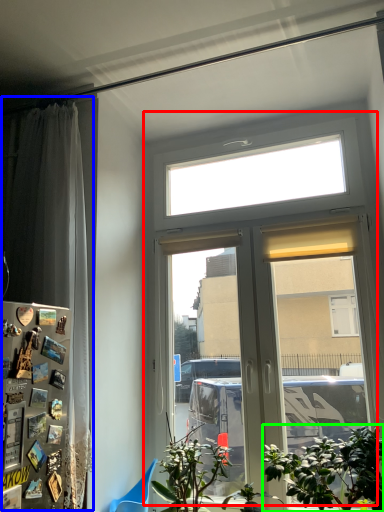
Question: Which object is positioned farthest from window (highlighted by a red box)? Select from curtain (highlighted by a blue box) and houseplant (highlighted by a green box).

Choices:
 (A) curtain
 (B) houseplant

Answer: (A)